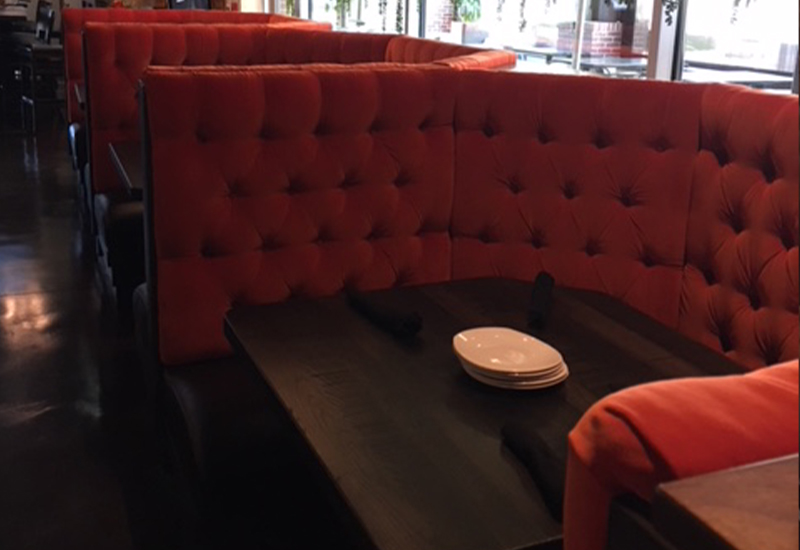
At what (x,y) coordinates should I click in order to perform the action: click on partition. Please return your answer as a coordinate pair (x, y). The width and height of the screenshot is (800, 550). Looking at the image, I should click on click(x=662, y=49).